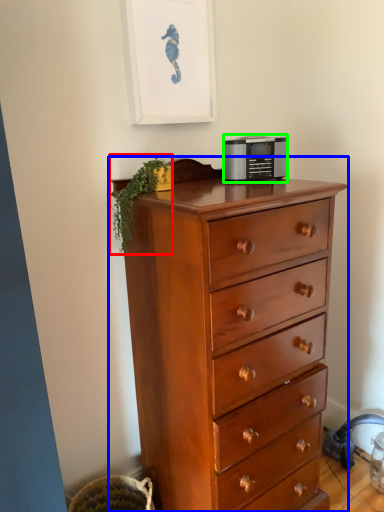
Question: Based on their relative distances, which object is farther from plant (highlighted by a red box)? Choose from chest of drawers (highlighted by a blue box) and appliance (highlighted by a green box).

Choices:
 (A) chest of drawers
 (B) appliance

Answer: (A)